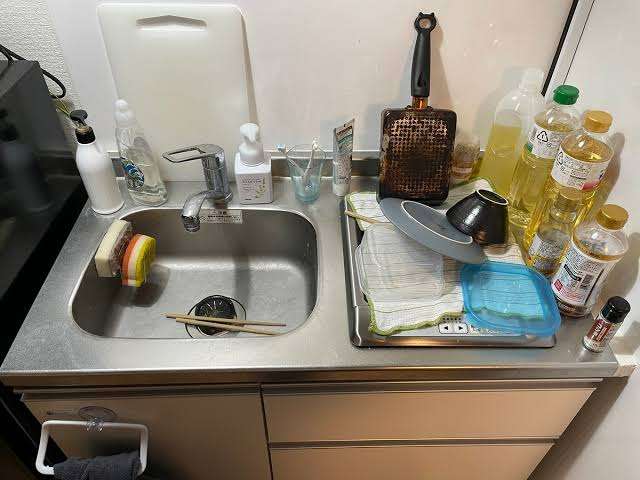
This screenshot has height=480, width=640. I want to click on nap cloth, so click(116, 466).